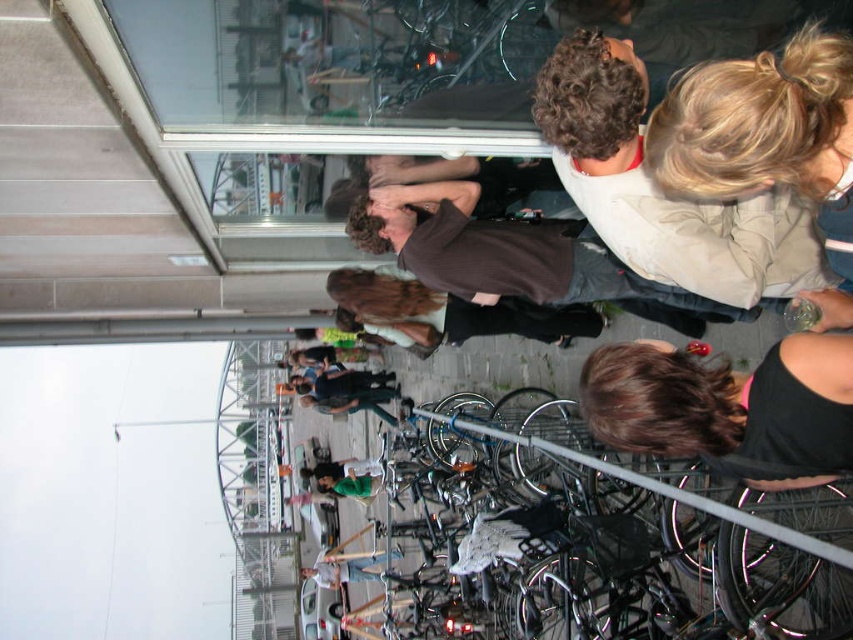
Question: Which of the following is the farthest from the observer?

Choices:
 (A) light beige jacket at upper right
 (B) black fabric at lower right
 (C) brown matte shirt at upper center

Answer: (C)

Question: Is black fabric at lower right below brown sweater at center?

Choices:
 (A) no
 (B) yes

Answer: (B)

Question: Does black fabric at lower right lie in front of brown matte shirt at upper center?

Choices:
 (A) no
 (B) yes

Answer: (B)

Question: Which point is closer to the camera?

Choices:
 (A) black fabric at lower right
 (B) light beige jacket at upper right

Answer: (A)

Question: Which point is closer to the camera?

Choices:
 (A) (566, 340)
 (B) (840, 371)
 (C) (376, 227)
 (D) (335, 568)

Answer: (B)

Question: Can you confirm if brown matte shirt at upper center is positioned to the right of light blue jeans at center?

Choices:
 (A) no
 (B) yes

Answer: (B)